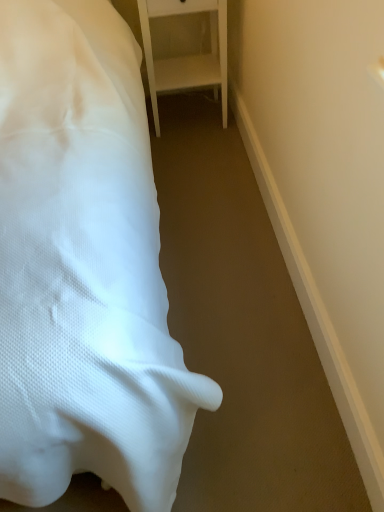
You are a GUI agent. You are given a task and a screenshot of the screen. Output one action in this format:
    pyautogui.click(x=<x>, y=<y>)
    Task: Click on the white glossy nightstand at upper center
    This screenshot has height=512, width=384.
    Given the screenshot: What is the action you would take?
    pyautogui.click(x=186, y=56)

This screenshot has width=384, height=512. Describe the element at coordinates (186, 56) in the screenshot. I see `white glossy nightstand at upper center` at that location.

This screenshot has width=384, height=512. I want to click on white glossy nightstand at upper center, so click(x=186, y=56).